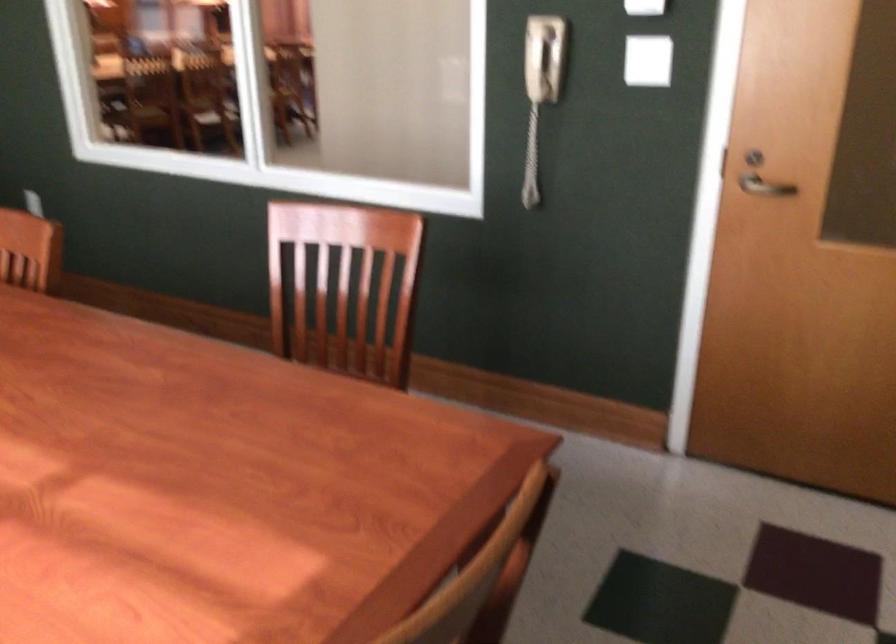
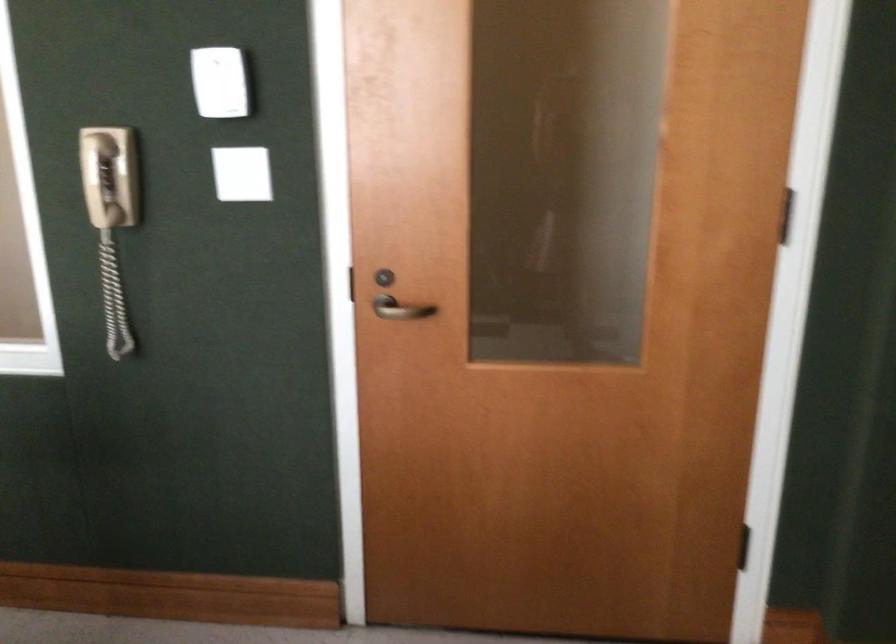
Question: The first image is from the beginning of the video and the second image is from the end. How did the camera likely rotate when shooting the video?

Choices:
 (A) Left
 (B) Right
 (C) Up
 (D) Down

Answer: (B)